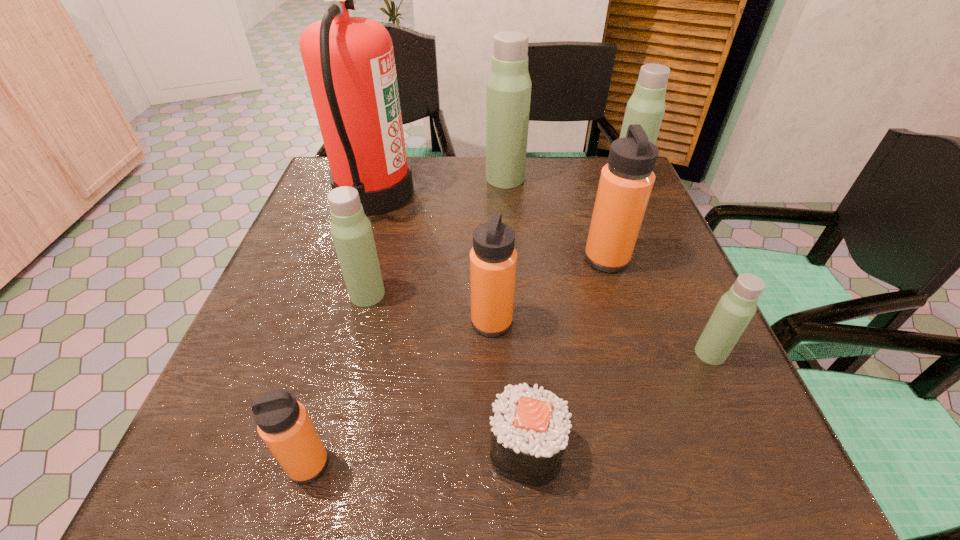
Find the location of a particular element. This screenshot has width=960, height=540. object at the far left corner is located at coordinates (349, 62).

Find the location of `object located in the near left corner section of the desktop`. object located in the near left corner section of the desktop is located at coordinates (282, 422).

Identify the location of object that is at the far right corner. (646, 107).

Locate an element on the screen. This screenshot has width=960, height=540. free space at the far edge is located at coordinates (570, 198).

At what (x,y) coordinates should I click in order to perform the action: click on vacant space at the near edge. Please return your answer as a coordinate pair (x, y). The height and width of the screenshot is (540, 960). Looking at the image, I should click on coord(386,474).

Find the location of a particular element. vacant area at the left edge of the desktop is located at coordinates (344, 278).

This screenshot has width=960, height=540. In order to click on free space at the right edge of the desktop in this screenshot , I will do `click(660, 424)`.

Image resolution: width=960 pixels, height=540 pixels. I want to click on free space that is in between the tallest object and the shortest object, so click(x=450, y=321).

Locate an element on the screen. free spot between the leftmost light thermos bottle and the second orange thermos bottle from left to right is located at coordinates (429, 308).

In order to click on free spot between the third nearest object and the second smallest light thermos bottle in this screenshot , I will do `click(539, 324)`.